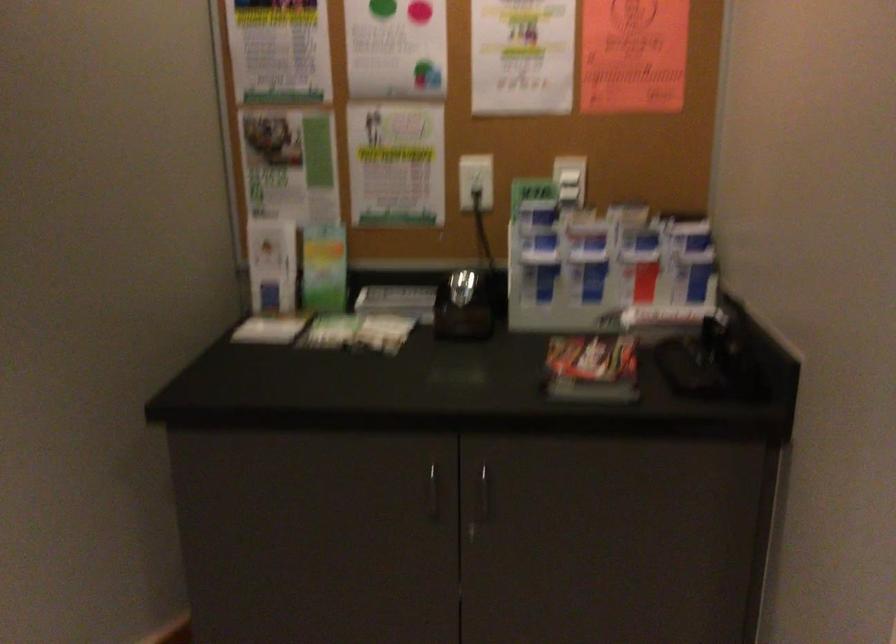
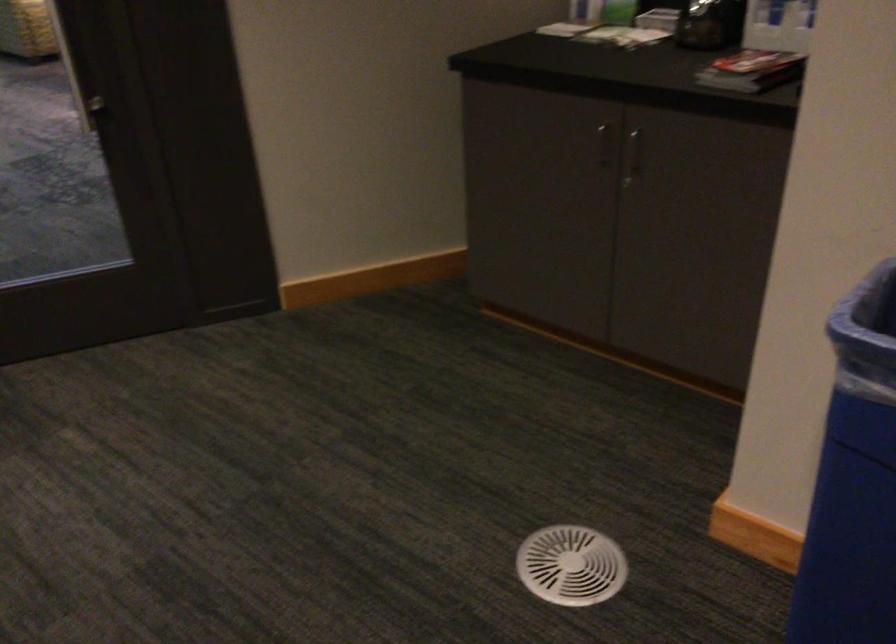
Based on the continuous images, in which direction is the camera rotating?

The camera's rotation is toward left-down.